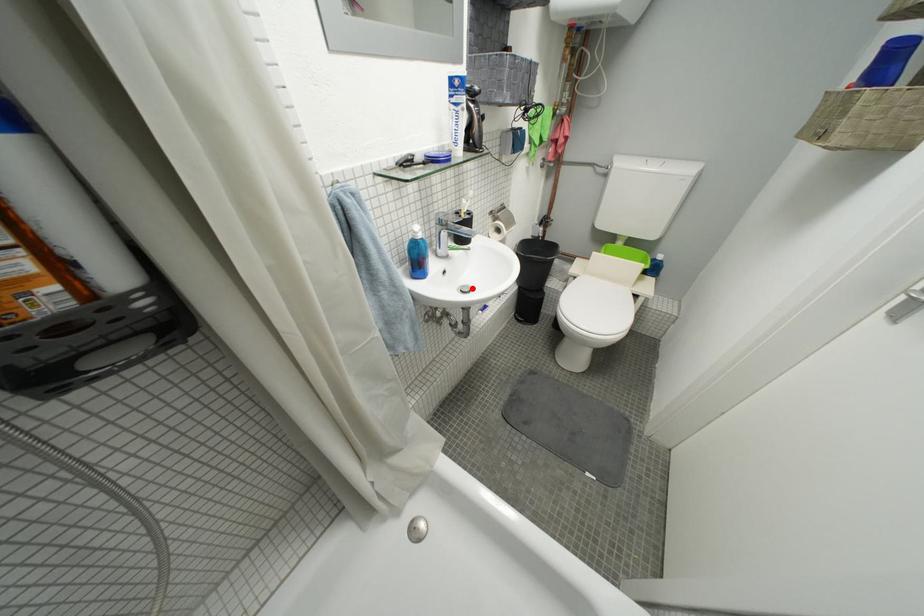
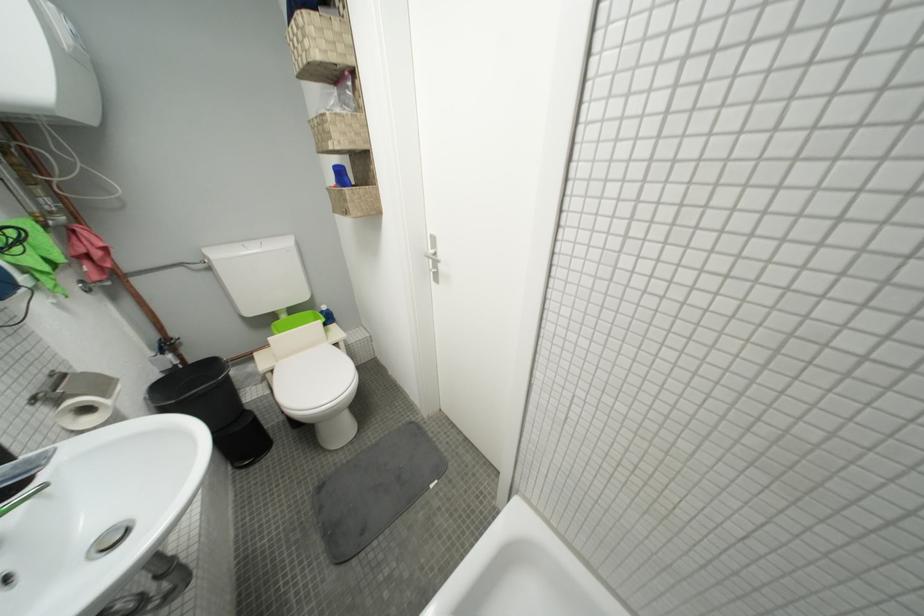
Question: I am providing you with two images of the same scene from different viewpoints. Given a red point in image1, look at the same physical point in image2. Is it:

Choices:
 (A) Closer to the viewpoint
 (B) Farther from the viewpoint

Answer: (B)